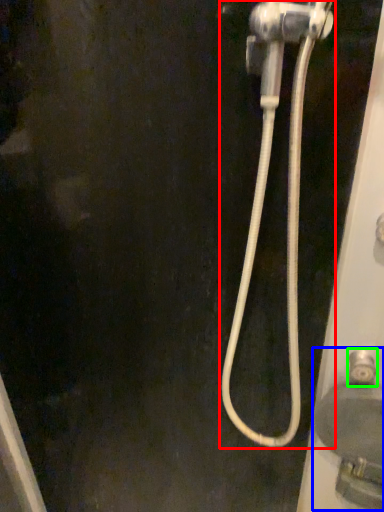
Question: Based on their relative distances, which object is nearer to plumbing fixture (highlighted by a red box)? Choose from sink (highlighted by a blue box) and faucet (highlighted by a green box).

Choices:
 (A) sink
 (B) faucet

Answer: (A)